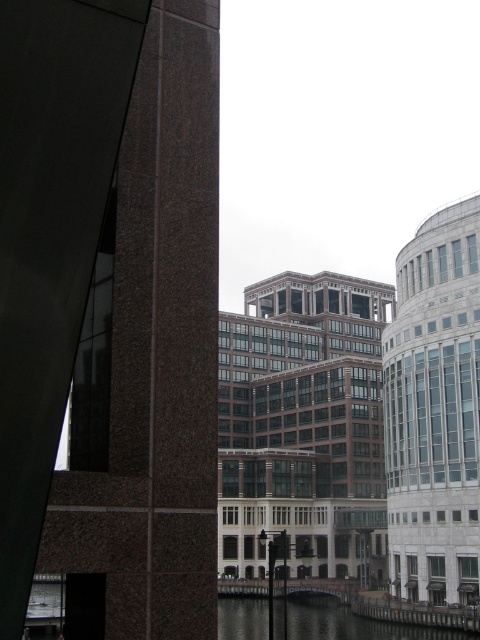
Question: Among these objects, which one is farthest from the camera?

Choices:
 (A) clear water at lower center
 (B) white glass tower at right

Answer: (B)

Question: Does brown stone tower at left have a smaller size compared to white glass tower at right?

Choices:
 (A) no
 (B) yes

Answer: (B)

Question: Does white glass tower at right appear on the left side of clear water at lower center?

Choices:
 (A) no
 (B) yes

Answer: (A)

Question: Is brown glass building at center bigger than white glass tower at right?

Choices:
 (A) yes
 (B) no

Answer: (A)

Question: Which object appears closest to the camera in this image?

Choices:
 (A) brown glass building at center
 (B) white glass tower at right
 (C) brown stone tower at left
 (D) clear water at lower center

Answer: (C)

Question: Which point is farther to the camera?

Choices:
 (A) (317, 420)
 (B) (131, 282)

Answer: (A)